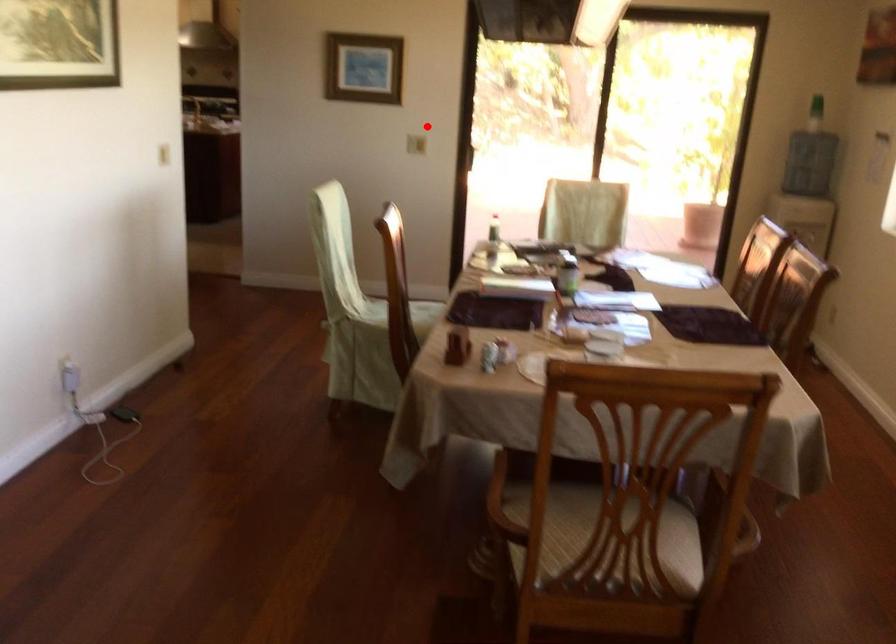
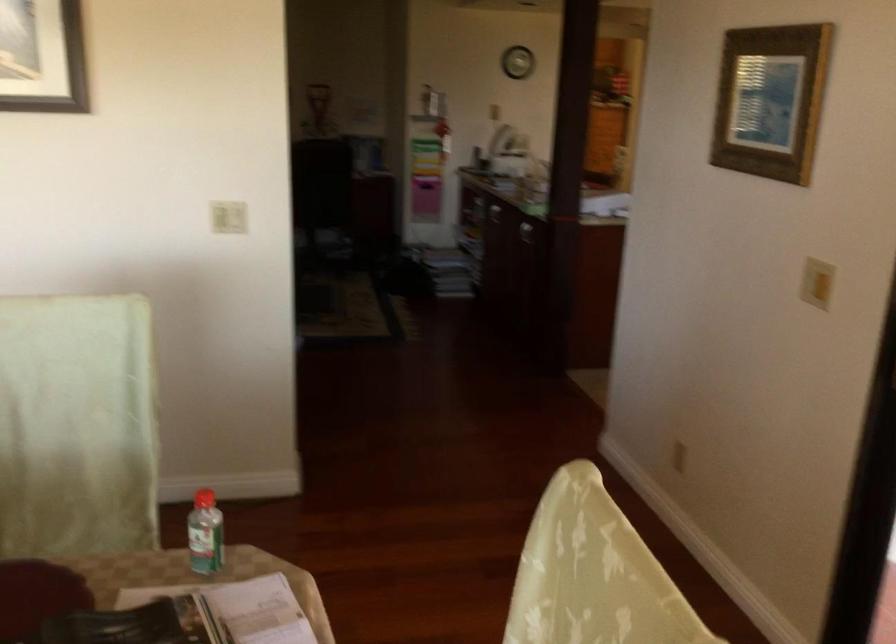
Question: A red point is marked in image1. In image2, is the corresponding 3D point closer to the camera or farther? Reply with the corresponding letter.

Choices:
 (A) The corresponding 3D point is closer.
 (B) The corresponding 3D point is farther.

Answer: (A)